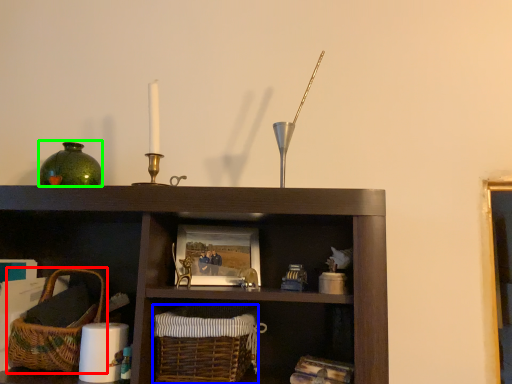
Question: Considering the real-world distances, which object is closest to basket (highlighted by a red box)? basket (highlighted by a blue box) or glass vase (highlighted by a green box).

Choices:
 (A) basket
 (B) glass vase

Answer: (A)